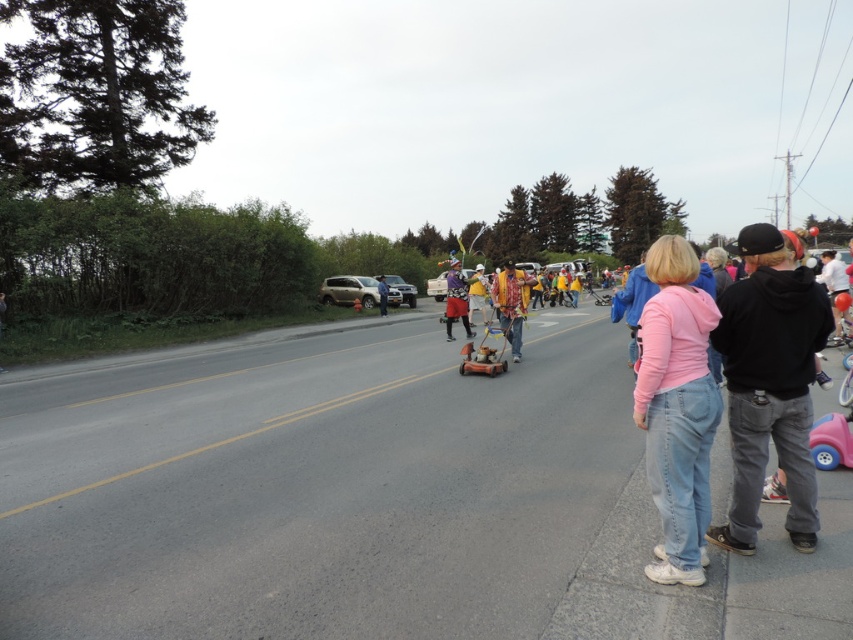
Can you confirm if black matte hoodie at right is bigger than yellow fabric at center?

No, black matte hoodie at right is not bigger than yellow fabric at center.

Is point (809, 497) positioned after point (485, 282)?

No, it is in front of (485, 282).

Which is in front, point (735, 452) or point (485, 321)?

Point (735, 452) is more forward.

The image size is (853, 640). Find the location of `black matte hoodie at right`. black matte hoodie at right is located at coordinates (769, 381).

Who is higher up, flannel shirt at center or wooden baby carriage at center?

flannel shirt at center

Is point (503, 330) farther from camera compared to point (460, 372)?

Yes, it is behind point (460, 372).

Find the location of a particular element. flannel shirt at center is located at coordinates coord(511,301).

Is pink cotton shirt at center closer to camera compared to matte black lawn mower at center?

Yes, it is.

Can you confirm if pink cotton shirt at center is taller than matte black lawn mower at center?

Yes.

At what (x,y) coordinates should I click in order to perform the action: click on pink cotton shirt at center. Please return your answer as a coordinate pair (x, y). This screenshot has width=853, height=640. Looking at the image, I should click on (677, 408).